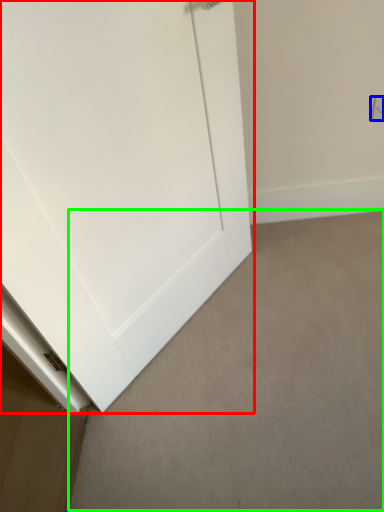
Question: Which is farther away from door (highlighted by a red box)? electric outlet (highlighted by a blue box) or plain (highlighted by a green box)?

Choices:
 (A) electric outlet
 (B) plain

Answer: (A)